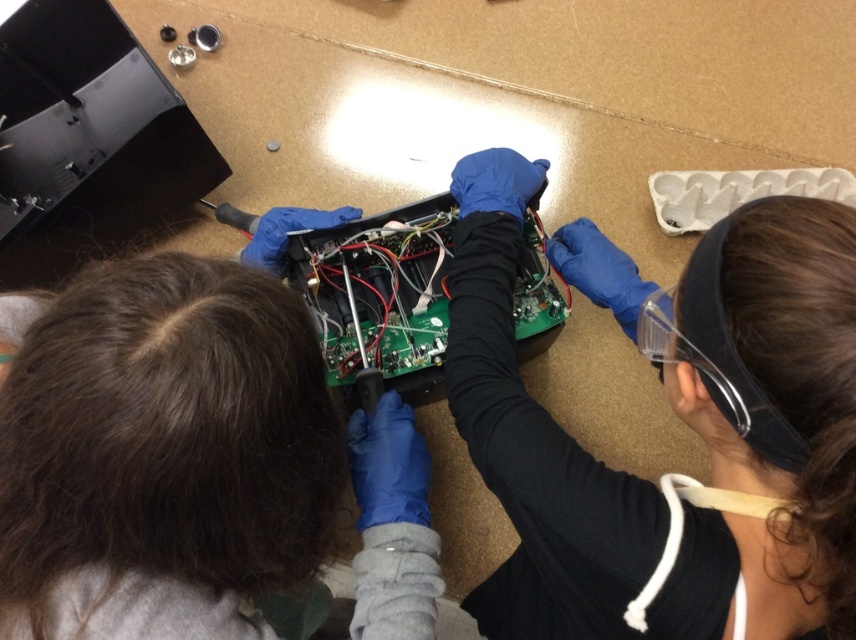
You are a technician who needs to place a new circuit board onto the table. The new circuit board is 12 inches wide. You see the matte black circuit board at center and the green circuit board at center. Which existing circuit board has a width that is smaller than the new one?

The matte black circuit board at center has a lesser width compared to green circuit board at center, so the matte black circuit board at center is smaller than the green circuit board at center. If the new circuit board is 12 inches wide, we need to compare it with both. However, the description only states the relative size between the two existing boards. Without specific measurements for either, we cannot definitively determine if either is smaller than 12 inches. The answer should focus on the given

You are a technician working on a circuit board project. You need to place a new component on the closest circuit board to you. Which circuit board should you choose between the matte black circuit board at center and the green circuit board at center?

The matte black circuit board at center is in front of the green circuit board at center, so you should place the new component on the matte black circuit board at center as it is closer to you.

You are a technician who needs to place a 10 inch long tool between the matte black circuit board at center and the green circuit board at center. Based on the scene description, will the tool fit between them?

The matte black circuit board at center and green circuit board at center are 10.31 inches apart from each other. Since the tool is 10 inches long, it will fit between them with a small amount of space remaining.